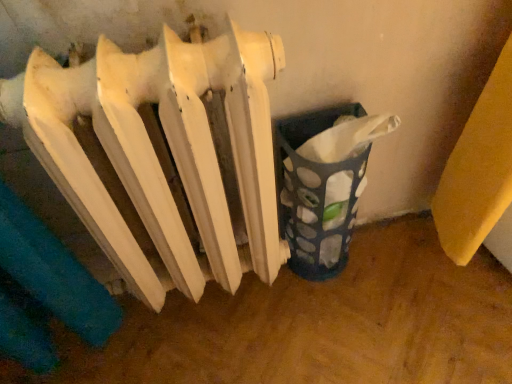
Question: From the image's perspective, is translucent plastic basket at lower right under white matte radiator at center?

Choices:
 (A) no
 (B) yes

Answer: (A)

Question: Is the depth of translucent plastic basket at lower right greater than that of white matte radiator at center?

Choices:
 (A) yes
 (B) no

Answer: (A)

Question: Is translucent plastic basket at lower right thinner than white matte radiator at center?

Choices:
 (A) yes
 (B) no

Answer: (A)

Question: Is translucent plastic basket at lower right positioned far away from white matte radiator at center?

Choices:
 (A) no
 (B) yes

Answer: (A)

Question: Is translucent plastic basket at lower right wider than white matte radiator at center?

Choices:
 (A) yes
 (B) no

Answer: (B)

Question: From a real-world perspective, does translucent plastic basket at lower right sit lower than white matte radiator at center?

Choices:
 (A) no
 (B) yes

Answer: (B)

Question: From the image's perspective, is white matte radiator at center above translucent plastic basket at lower right?

Choices:
 (A) no
 (B) yes

Answer: (A)

Question: Is white matte radiator at center further to camera compared to translucent plastic basket at lower right?

Choices:
 (A) yes
 (B) no

Answer: (B)

Question: Could you tell me if white matte radiator at center is turned towards translucent plastic basket at lower right?

Choices:
 (A) yes
 (B) no

Answer: (B)

Question: Does white matte radiator at center appear on the left side of translucent plastic basket at lower right?

Choices:
 (A) yes
 (B) no

Answer: (A)

Question: Is white matte radiator at center in contact with translucent plastic basket at lower right?

Choices:
 (A) no
 (B) yes

Answer: (A)

Question: From a real-world perspective, is white matte radiator at center physically below translucent plastic basket at lower right?

Choices:
 (A) no
 (B) yes

Answer: (A)

Question: Would you say translucent plastic basket at lower right is to the left or to the right of white matte radiator at center in the picture?

Choices:
 (A) right
 (B) left

Answer: (A)